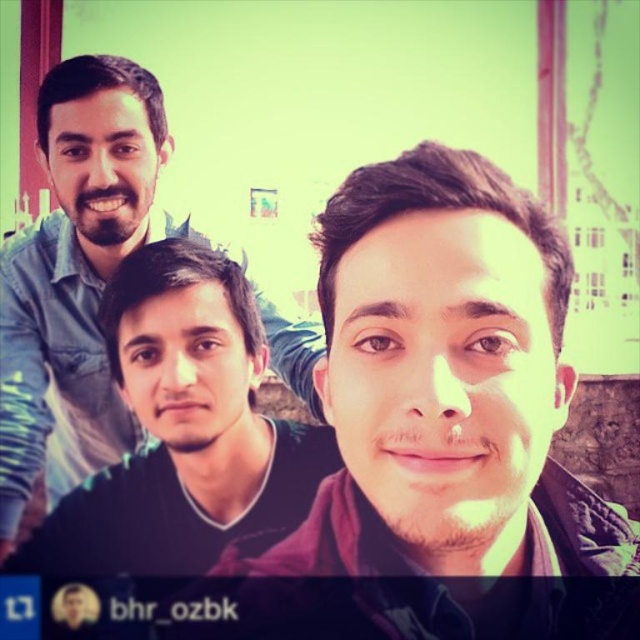
You are a photographer trying to adjust the lighting for a group photo. You need to ensure that the smooth skin face at center and the matte blue shirt at upper left are both well lit. Given their current distance apart, what adjustment could you make to the lighting setup to evenly illuminate both subjects?

Since the smooth skin face at center and the matte blue shirt at upper left are 1.10 meters apart, you could use a softbox or reflector positioned between them to ensure even lighting across both subjects.

Based on the photo, you are taking a photo and want to ensure the smooth skin face at center and the matte blue shirt at upper left are both in focus. Which object should you adjust the camera focus to prioritize for better clarity?

The smooth skin face at center is closer to the viewer than the matte blue shirt at upper left. To ensure both are in focus, prioritize focusing on the smooth skin face at center since it is closer, as depth of field may naturally capture the background object in focus as well.